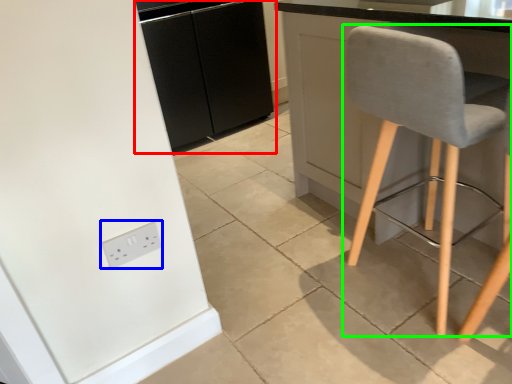
Question: Which object is the closest to the cabinetry (highlighted by a red box)? Choose among these: socket (highlighted by a blue box) or chair (highlighted by a green box).

Choices:
 (A) socket
 (B) chair

Answer: (B)